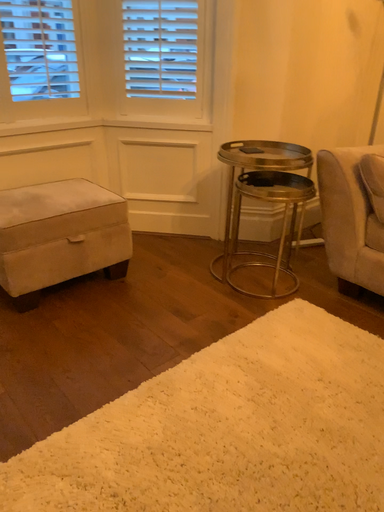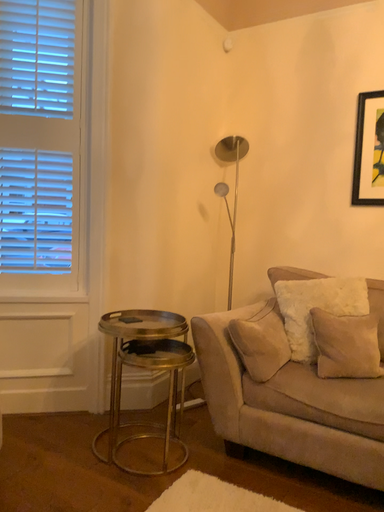
Question: Which way did the camera rotate in the video?

Choices:
 (A) rotated downward
 (B) rotated upward

Answer: (B)